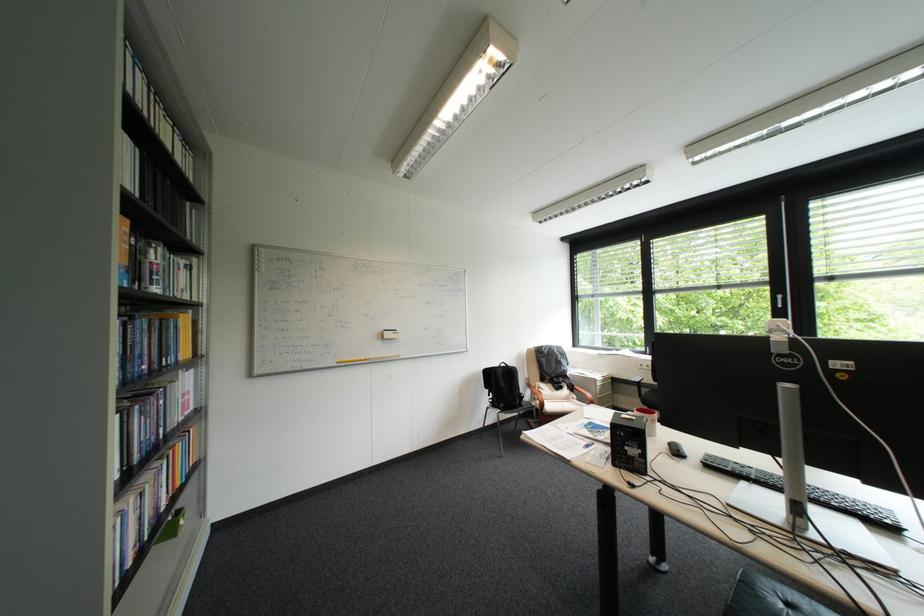
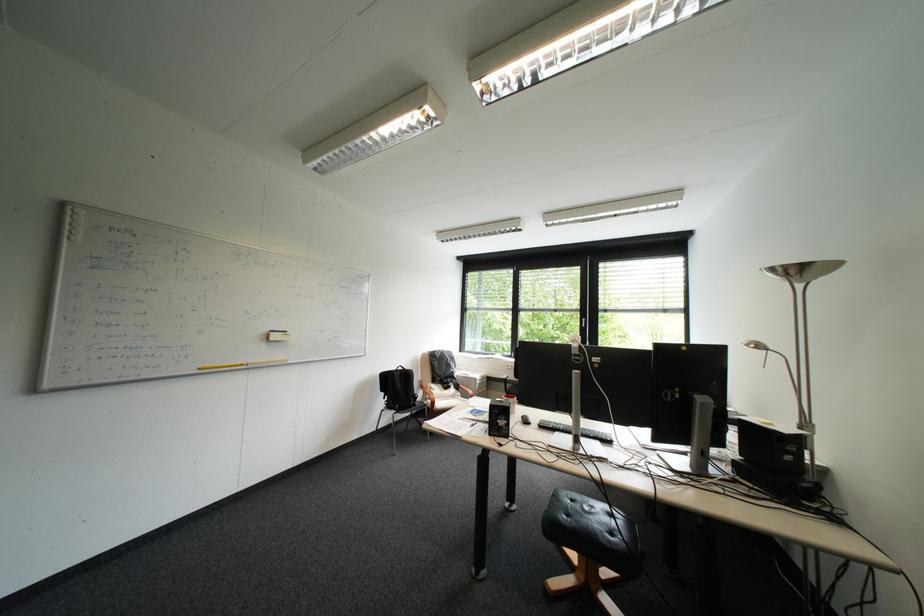
From the picture: What movement of the cameraman would produce the second image?

The cameraman walked toward left, backward.